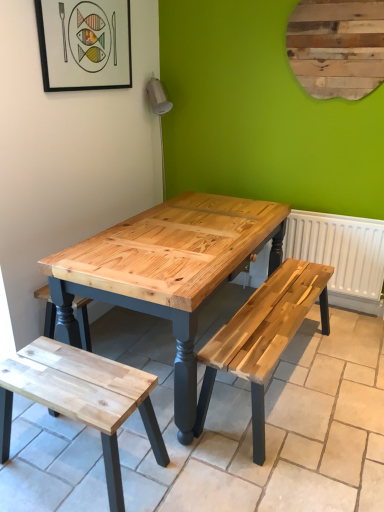
Find the location of `vacant point above natural wood bench at lower left (from a real-world perspective)`. vacant point above natural wood bench at lower left (from a real-world perspective) is located at coordinates (78, 375).